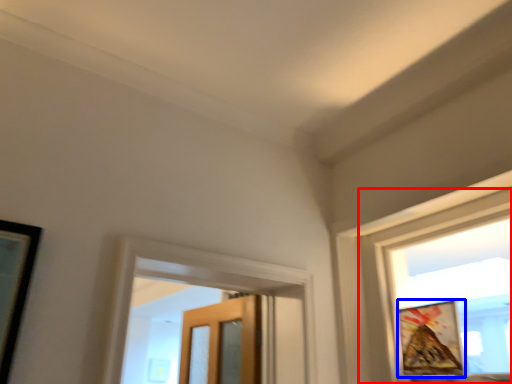
Question: Which object is closer to the camera taking this photo, window (highlighted by a red box) or picture frame (highlighted by a blue box)?

Choices:
 (A) window
 (B) picture frame

Answer: (A)